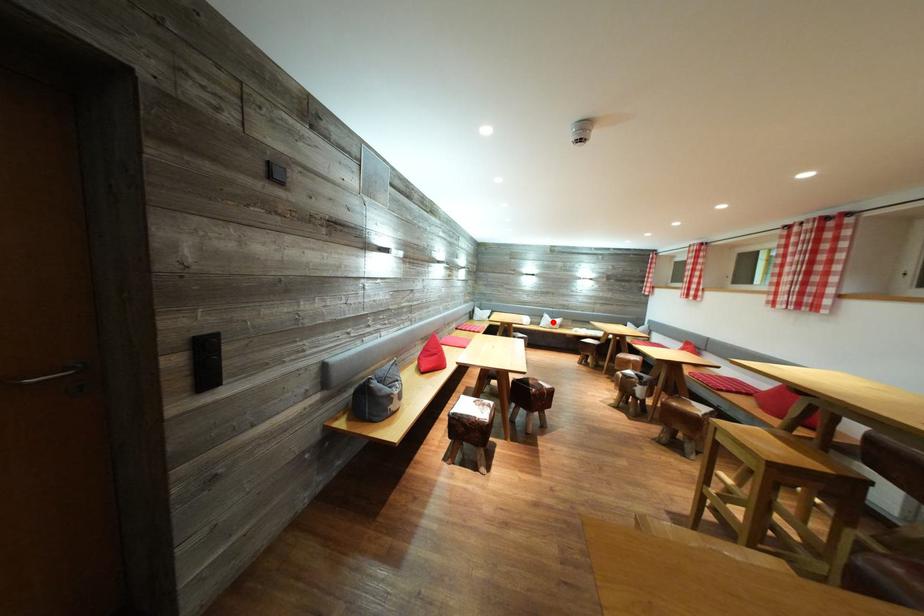
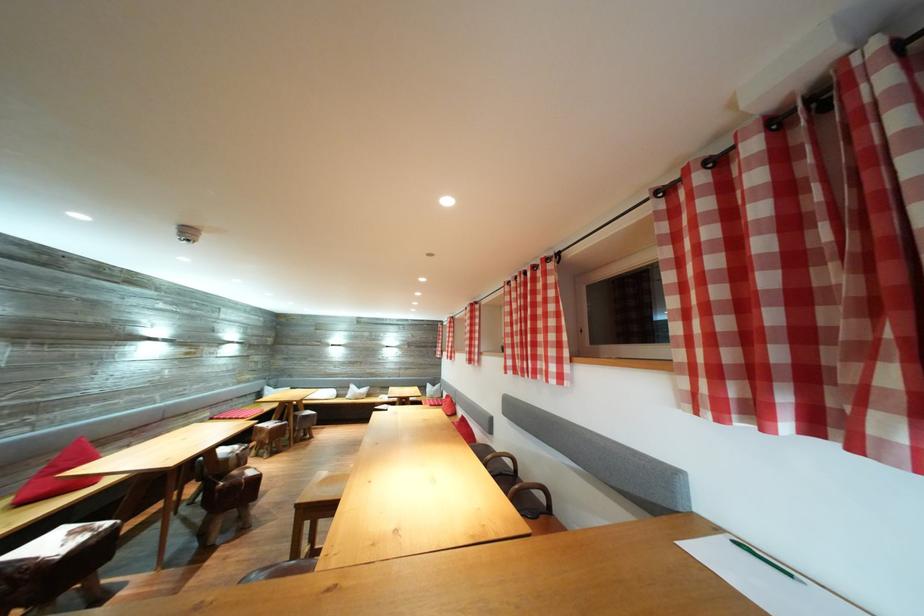
Find the pixel in the second image that matches the highlighted location in the first image.

(359, 392)